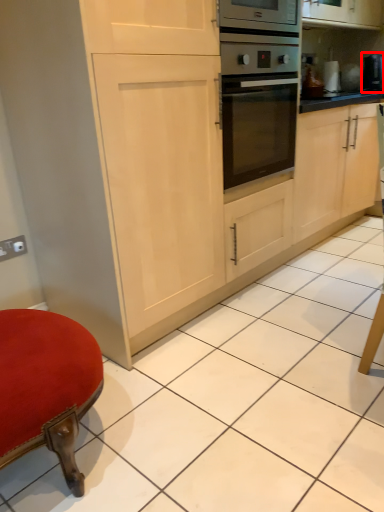
Question: From the image's perspective, where is appliance (annotated by the red box) located relative to electric outlet?

Choices:
 (A) above
 (B) below

Answer: (A)